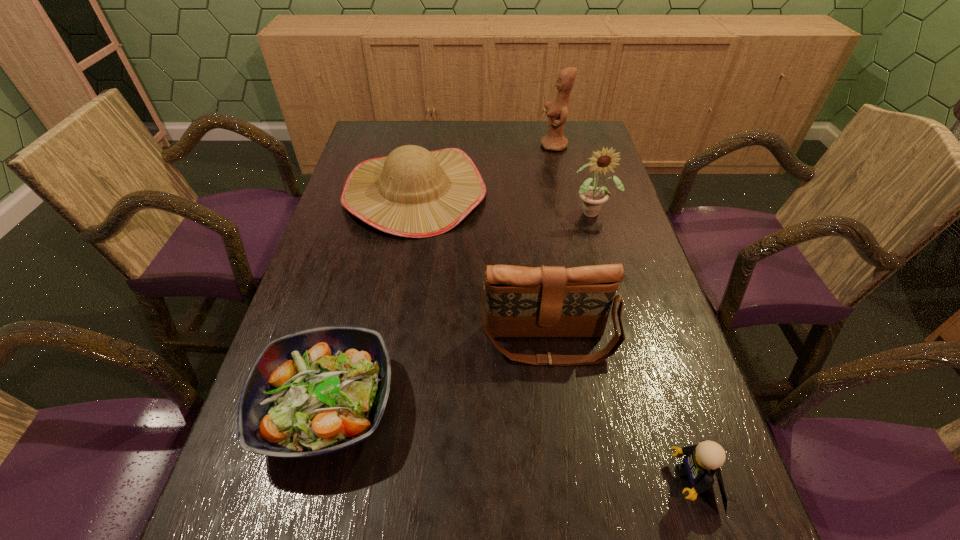
Where is `vacant space at the far left corner`? vacant space at the far left corner is located at coordinates (362, 148).

Find the location of a particular element. The width and height of the screenshot is (960, 540). free space between the Lego and the sunflower is located at coordinates (642, 346).

This screenshot has width=960, height=540. I want to click on vacant point located between the salad plate and the sunflower, so click(x=460, y=309).

The height and width of the screenshot is (540, 960). In order to click on free space between the salad plate and the fourth tallest object in this screenshot , I will do `click(372, 299)`.

Image resolution: width=960 pixels, height=540 pixels. I want to click on unoccupied position between the fourth tallest object and the shoulder bag, so click(x=482, y=268).

You are a GUI agent. You are given a task and a screenshot of the screen. Output one action in this format:
    pyautogui.click(x=<x>, y=<y>)
    Task: Click on the free spot between the sunflower and the fourth tallest object
    
    Given the screenshot: What is the action you would take?
    pyautogui.click(x=504, y=202)

Find the location of a particular element. The width and height of the screenshot is (960, 540). vacant area that lies between the Lego and the shortest object is located at coordinates [x=510, y=443].

Identify the location of unoccupied position between the figurine and the Lego. (623, 313).

Locate an element on the screen. This screenshot has width=960, height=540. unoccupied area between the farthest object and the shortest object is located at coordinates (441, 275).

Locate an element on the screen. unoccupied position between the sunflower and the fourth tallest object is located at coordinates (504, 202).